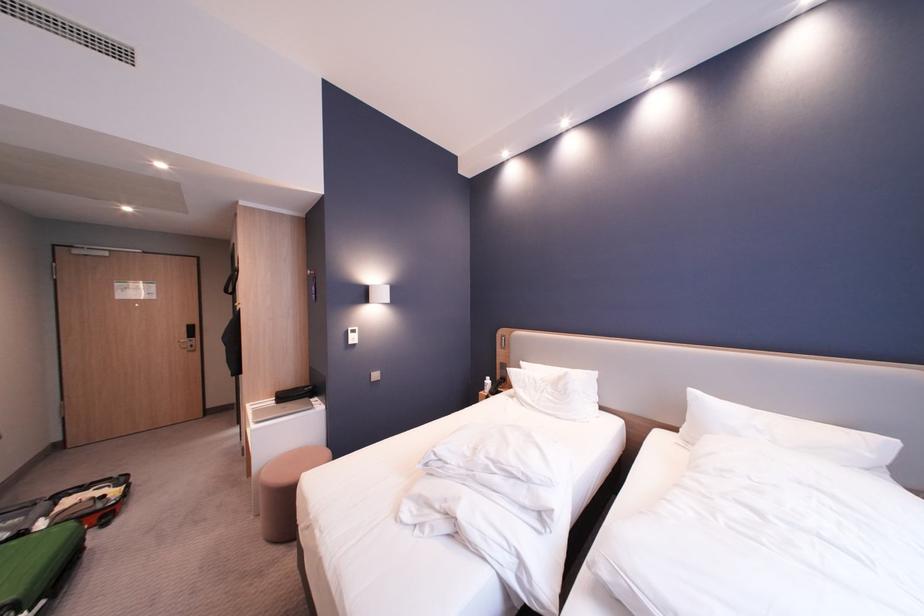
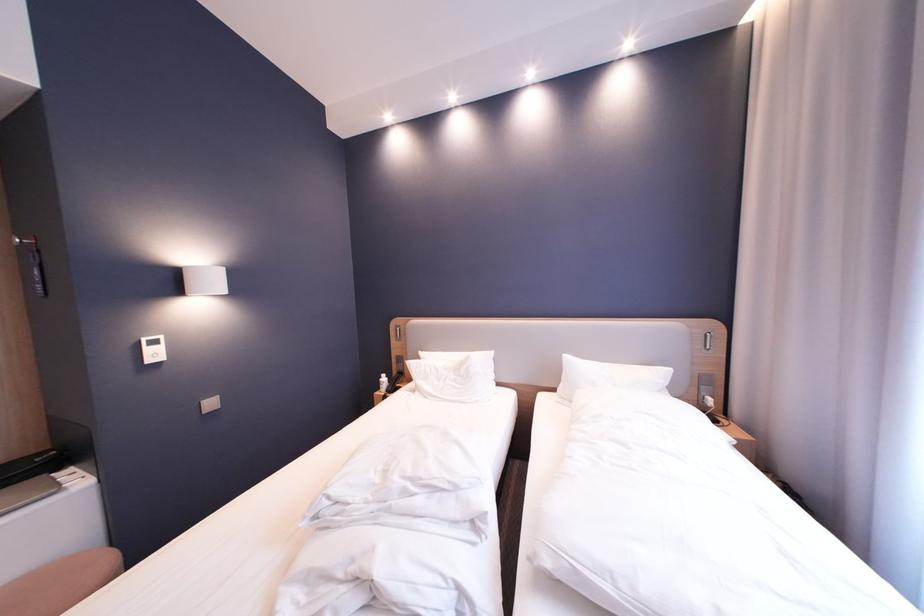
In the second image, find the point that corresponds to point 317,390 in the first image.

(51, 460)